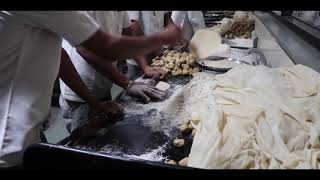
Image resolution: width=320 pixels, height=180 pixels. What are the coordinates of `table` in the screenshot? It's located at (153, 142).